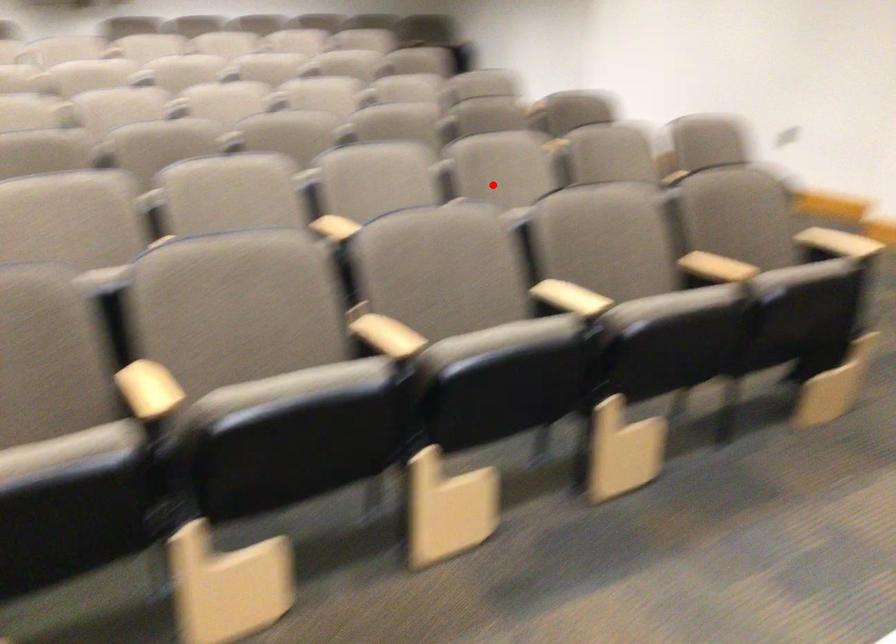
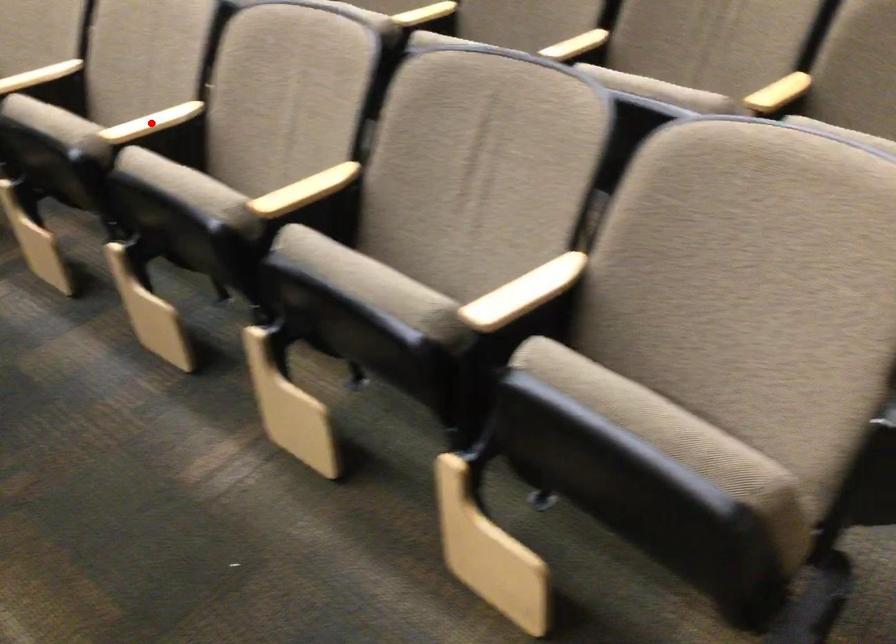
I am providing you with two images of the same scene from different viewpoints. A red point is marked on the first image and another point is marked on the second image. Does the point marked in image1 correspond to the same location as the one in image2?

Yes